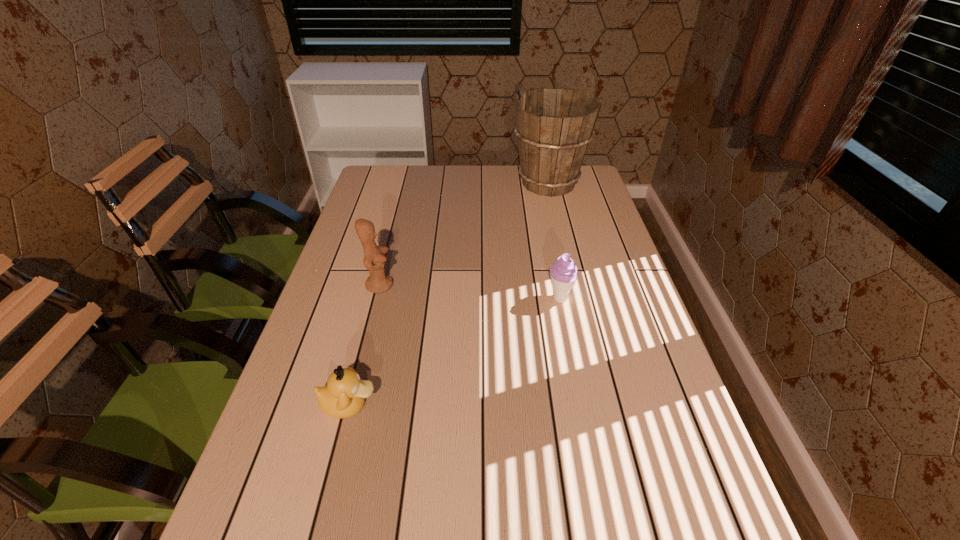
This screenshot has height=540, width=960. I want to click on vacant point located between the third shortest object and the duckling, so click(365, 345).

Where is `vacant space that is in between the icecream and the nearest object`? The width and height of the screenshot is (960, 540). vacant space that is in between the icecream and the nearest object is located at coordinates coord(454,352).

The image size is (960, 540). I want to click on unoccupied position between the tallest object and the icecream, so (554, 241).

Find the location of a particular element. free point between the icecream and the tallest object is located at coordinates (554, 241).

At what (x,y) coordinates should I click in order to perform the action: click on free space between the third shortest object and the icecream. Please return your answer as a coordinate pair (x, y). The height and width of the screenshot is (540, 960). Looking at the image, I should click on (469, 292).

Locate an element on the screen. free space between the second tallest object and the third tallest object is located at coordinates (469, 292).

Locate an element on the screen. Image resolution: width=960 pixels, height=540 pixels. empty space between the bucket and the icecream is located at coordinates (554, 241).

Where is `vacant space that's between the duckling and the third tallest object`? Image resolution: width=960 pixels, height=540 pixels. vacant space that's between the duckling and the third tallest object is located at coordinates (454, 352).

Locate an element on the screen. This screenshot has width=960, height=540. empty space that is in between the nearest object and the tallest object is located at coordinates (449, 294).

This screenshot has height=540, width=960. What are the coordinates of `free space between the icecream and the duckling` in the screenshot? It's located at (454, 352).